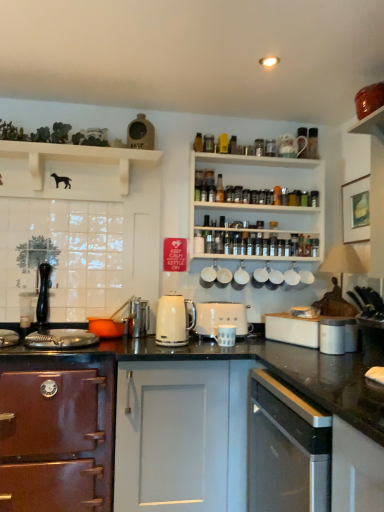
Question: Based on their positions, is white ceramic mugs at center, which is the fourth appliance from right to left, located to the left or right of white matte coffee cup at center, which ranks as the third appliance in right-to-left order?

Choices:
 (A) right
 (B) left

Answer: (B)

Question: From a real-world perspective, relative to white matte coffee cup at center, positioned as the seventh appliance in left-to-right order, is white ceramic mugs at center, which is the sixth appliance in left-to-right order, vertically above or below?

Choices:
 (A) below
 (B) above

Answer: (A)

Question: Which is nearer to the white matte coffee cup at center, the first appliance positioned from the right?

Choices:
 (A) satin silver dishwasher at lower right, acting as the second cabinetry starting from the left
 (B) white matte coffee cup at center, which ranks as the third appliance in right-to-left order
 (C) black matte dog at upper left
 (D) white ceramic mug at upper center, marked as the 5th appliance in a left-to-right arrangement
 (E) white matte cup at upper center, which ranks as the eighth appliance in left-to-right order

Answer: (E)

Question: Which object is the farthest from the metallic silver canisters at center, which is the first appliance from left to right?

Choices:
 (A) white ceramic mug at upper center, marked as the 8th appliance in a right-to-left arrangement
 (B) matte brown oven at left, the first cabinetry when ordered from left to right
 (C) black matte dog at upper left
 (D) white ceramic mugs at center, which is the fourth appliance from right to left
 (E) white ceramic mug at upper center, acting as the fifth appliance starting from the right

Answer: (C)